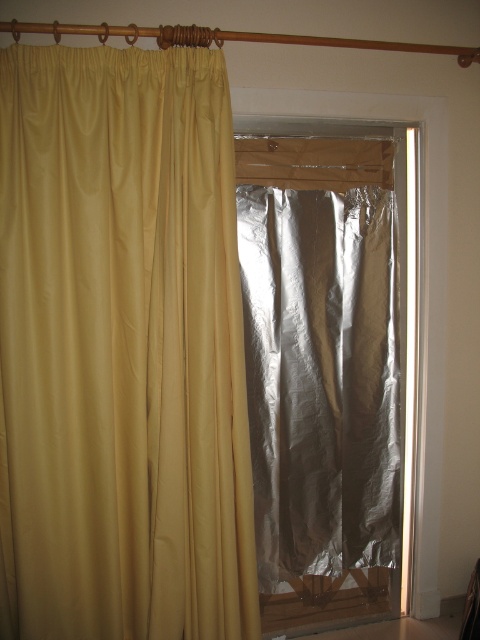
Measure the distance between matte yellow curtain at left and shiny metallic screen door at center.

matte yellow curtain at left is 18.91 inches from shiny metallic screen door at center.

This screenshot has height=640, width=480. I want to click on matte yellow curtain at left, so click(121, 348).

Locate an element on the screen. This screenshot has width=480, height=640. matte yellow curtain at left is located at coordinates (121, 348).